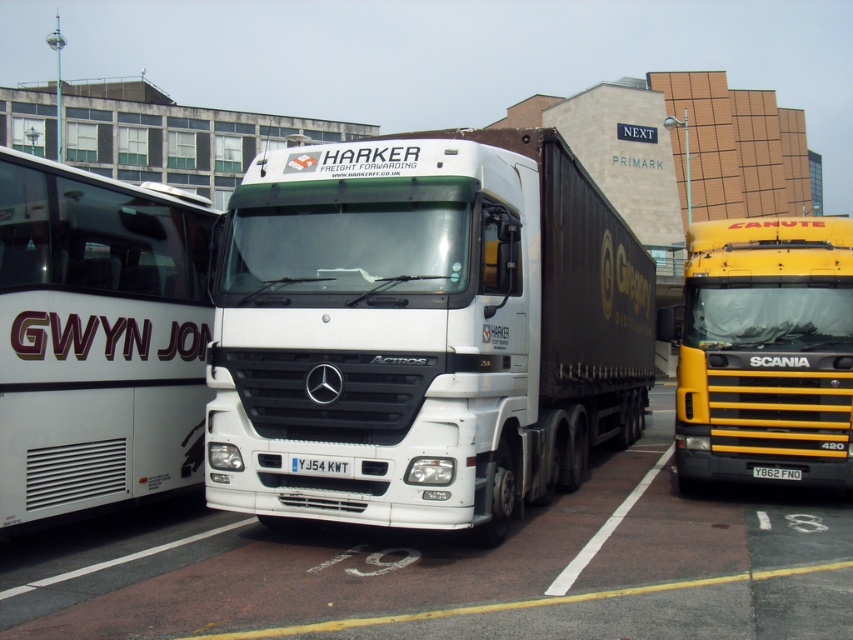
Based on the scene description, where is the white glossy bus at left located in the image?

The white glossy bus at left is located at point (97, 339).

You are standing at the point marked as point (576, 168). There is a white Mercedes Benz Actros truck with a black trailer and a white bus named GWYN JON parked side by side. Which vehicle is closer to you?

The white bus named GWYN JON is closer to the point (576, 168) because they are 11.00 meters apart.